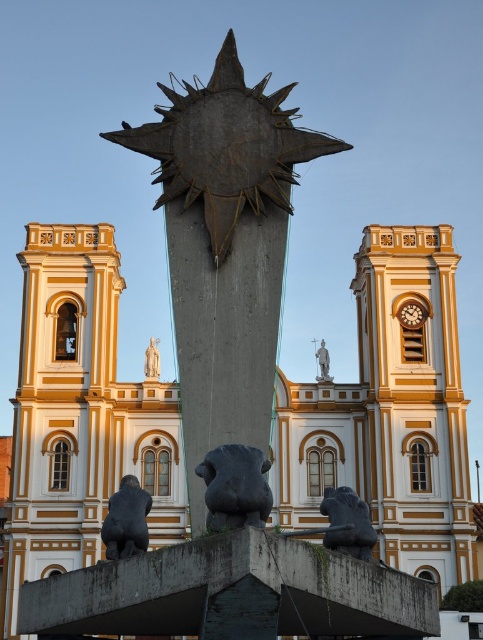
Question: Can you confirm if dark gray stone lion at lower center is thinner than bronze statue at center?

Choices:
 (A) yes
 (B) no

Answer: (B)

Question: Which of the following is the farthest from the observer?

Choices:
 (A) white marble statue at center
 (B) dark gray stone lion at lower center
 (C) black stone bear at center

Answer: (A)

Question: Which point is farther to the camera?

Choices:
 (A) bronze statue at center
 (B) white marble statue at center
 (C) black stone lion at lower left

Answer: (B)

Question: Is gold/golden stone church at center to the right of bronze statue at center from the viewer's perspective?

Choices:
 (A) yes
 (B) no

Answer: (A)

Question: Which object is closer to the camera taking this photo?

Choices:
 (A) black stone lion at lower left
 (B) bronze statue at center
 (C) metallic clock face at center
 (D) gold/golden stone church at center

Answer: (A)

Question: Is gold/golden stone church at center bigger than black stone bear at center?

Choices:
 (A) no
 (B) yes

Answer: (B)